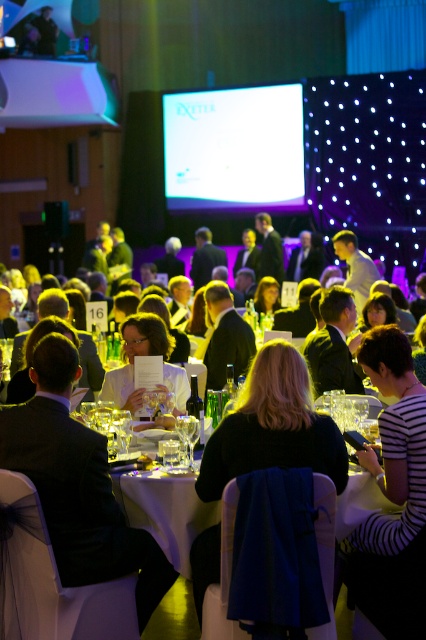
Question: Which object appears closest to the camera in this image?

Choices:
 (A) white fabric chair at center
 (B) white glossy shirt at center

Answer: (A)

Question: Is white fabric chair at center wider than white glossy shirt at center?

Choices:
 (A) yes
 (B) no

Answer: (A)

Question: Is black matte jacket at center wider than white glossy shirt at center?

Choices:
 (A) no
 (B) yes

Answer: (B)

Question: Is black matte jacket at center positioned behind white glossy shirt at center?

Choices:
 (A) yes
 (B) no

Answer: (B)

Question: Which point is closer to the camera?

Choices:
 (A) black matte jacket at center
 (B) white glossy shirt at center

Answer: (A)

Question: Considering the real-world distances, which object is closest to the white glossy shirt at center?

Choices:
 (A) white fabric chair at center
 (B) black matte jacket at center

Answer: (A)